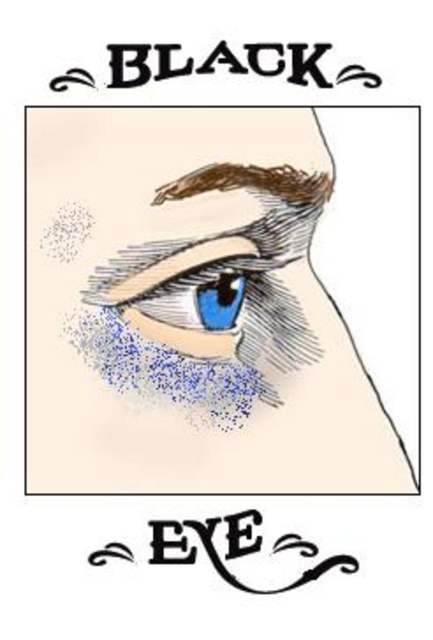
Question: Is matte black eye at upper center in front of blue glossy eye at center?

Choices:
 (A) no
 (B) yes

Answer: (B)

Question: Estimate the real-world distances between objects in this image. Which object is farther from the blue glossy eye at center?

Choices:
 (A) brown textured eyebrow at upper center
 (B) matte black eye at upper center

Answer: (A)

Question: Can you confirm if matte black eye at upper center is wider than blue glossy eye at center?

Choices:
 (A) yes
 (B) no

Answer: (A)

Question: From the image, what is the correct spatial relationship of matte black eye at upper center in relation to blue glossy eye at center?

Choices:
 (A) right
 (B) left

Answer: (A)

Question: Which object is positioned farthest from the brown textured eyebrow at upper center?

Choices:
 (A) blue glossy eye at center
 (B) matte black eye at upper center

Answer: (B)

Question: Among these points, which one is farthest from the camera?

Choices:
 (A) (55, 388)
 (B) (157, 196)
 (C) (148, 307)

Answer: (A)